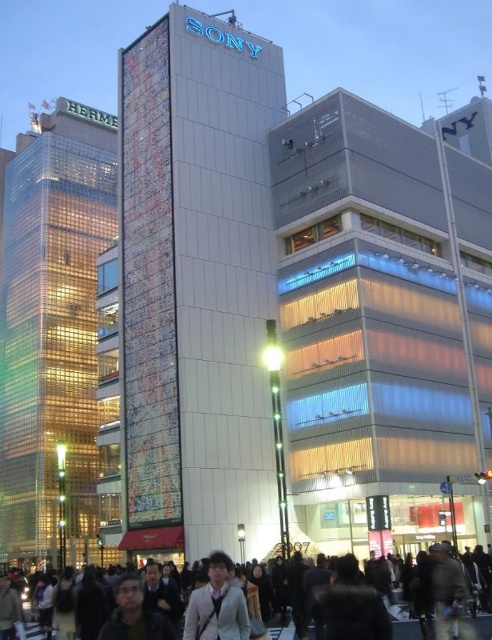
You are a photographer trying to capture a clear shot of the light brown leather jacket at center. However, there is a dark clothing crowd at center in the background. Will the jacket be visible against the crowd?

The light brown leather jacket at center is in front of the dark clothing crowd at center, so it will be visible as it is positioned in front of the crowd.

You are a photographer standing at the Sony building, wanting to capture a photo of the light brown leather jacket at center and the dark clothing crowd at center in the same frame. Can you fit both subjects into your camera viewfinder without moving your position?

The light brown leather jacket at center and dark clothing crowd at center are 10.47 meters apart. Since the distance between them is significant, it might be challenging to fit both into the same frame without zooming out excessively, but it is possible depending on the camera lens and angle. However, based on the provided information, the exact feasibility isn